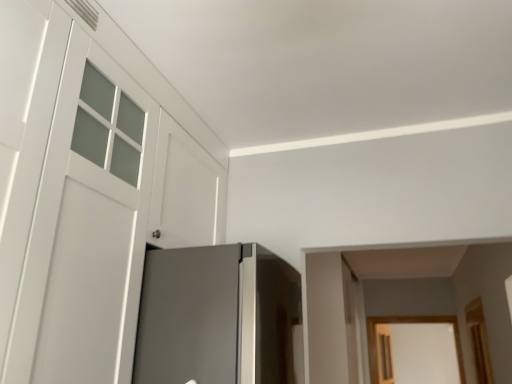
Question: From a real-world perspective, is clear glass screen door at lower right on white matte door at left?

Choices:
 (A) no
 (B) yes

Answer: (A)

Question: From the image's perspective, does clear glass screen door at lower right appear higher than white matte door at left?

Choices:
 (A) no
 (B) yes

Answer: (A)

Question: Can you confirm if clear glass screen door at lower right is thinner than white matte door at left?

Choices:
 (A) yes
 (B) no

Answer: (A)

Question: Can you confirm if clear glass screen door at lower right is shorter than white matte door at left?

Choices:
 (A) no
 (B) yes

Answer: (B)

Question: Does clear glass screen door at lower right touch white matte door at left?

Choices:
 (A) yes
 (B) no

Answer: (B)

Question: Does clear glass screen door at lower right have a smaller size compared to white matte door at left?

Choices:
 (A) no
 (B) yes

Answer: (B)

Question: Can you confirm if white matte door at left is wider than clear glass screen door at lower right?

Choices:
 (A) no
 (B) yes

Answer: (B)

Question: From the image's perspective, would you say white matte door at left is positioned over clear glass screen door at lower right?

Choices:
 (A) yes
 (B) no

Answer: (A)

Question: Is white matte door at left facing towards clear glass screen door at lower right?

Choices:
 (A) yes
 (B) no

Answer: (B)

Question: From the image's perspective, is white matte door at left under clear glass screen door at lower right?

Choices:
 (A) no
 (B) yes

Answer: (A)

Question: Does white matte door at left appear on the left side of clear glass screen door at lower right?

Choices:
 (A) yes
 (B) no

Answer: (A)

Question: Is white matte door at left located outside clear glass screen door at lower right?

Choices:
 (A) yes
 (B) no

Answer: (A)

Question: Is white matte door at left bigger or smaller than clear glass screen door at lower right?

Choices:
 (A) small
 (B) big

Answer: (B)